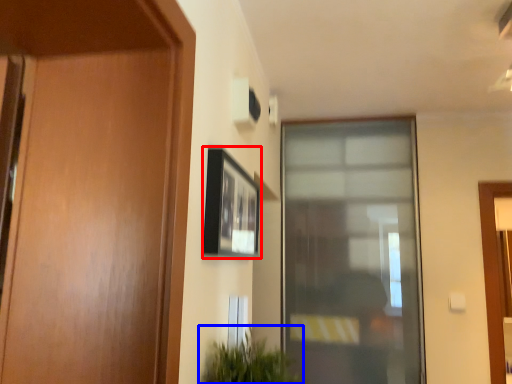
Question: Which of the following is the closest to the observer, picture frame (highlighted by a red box) or houseplant (highlighted by a blue box)?

Choices:
 (A) picture frame
 (B) houseplant

Answer: (B)